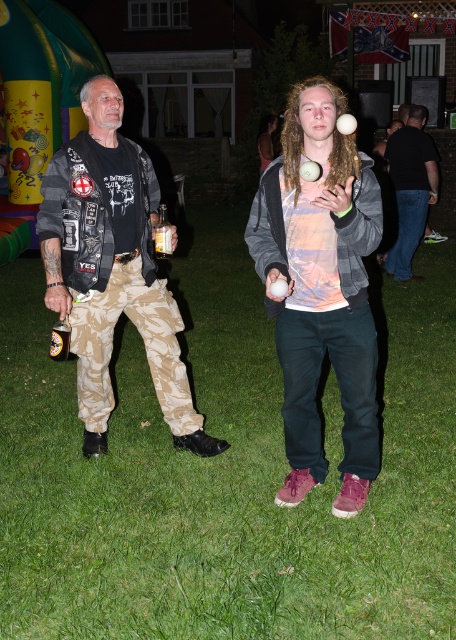
You are a photographer trying to capture a photo of the green grass at center and the camouflage pants at left. Which object appears larger in the photo?

The camouflage pants at left appears larger than the green grass at center in the photo because the green grass at center is smaller than camouflage pants at left.

You are at a party and want to grab a drink. You see a matte gray hoodie at center and a metallic gold can at lower left. Which object is closer to your right side?

The matte gray hoodie at center is positioned on the right side of the metallic gold can at lower left, so the matte gray hoodie at center is closer to your right side.

You are trying to place the metallic gold can at lower left into the pocket of the matte gray hoodie at center. Will it fit?

The matte gray hoodie at center might be wider than metallic gold can at lower left, so there is a possibility that the metallic gold can at lower left will fit in the pocket.